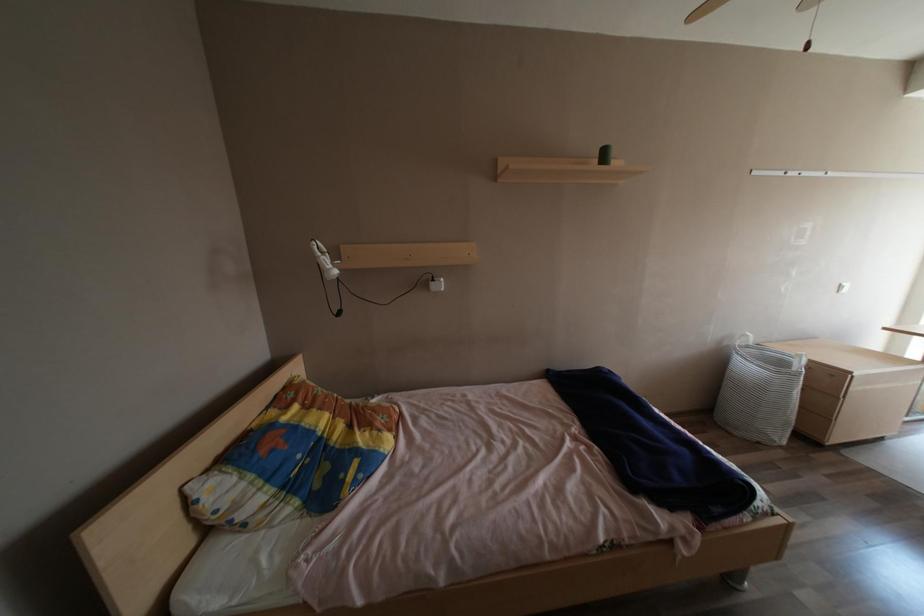
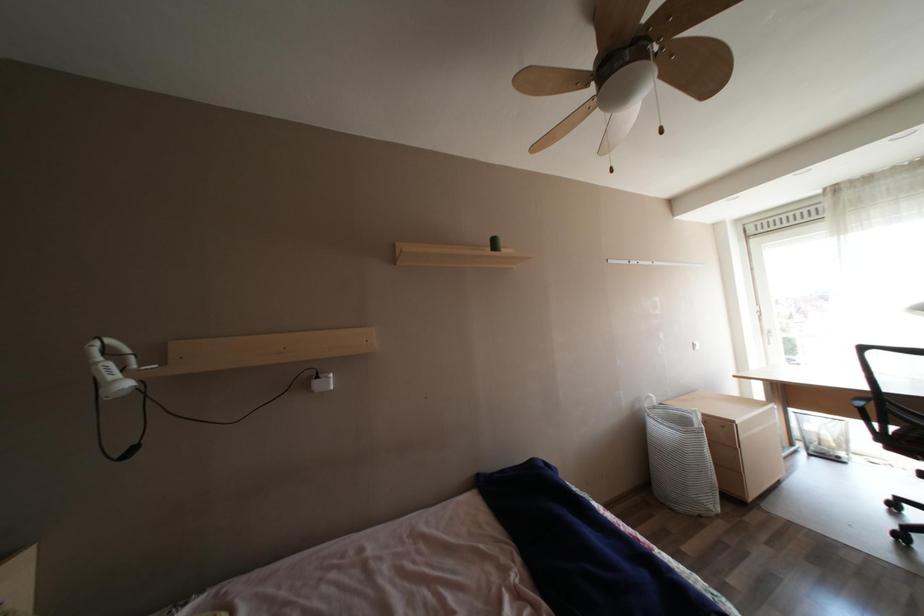
In a continuous first-person perspective shot, in which direction is the camera moving?

The movement direction of the cameraman is right, forward.